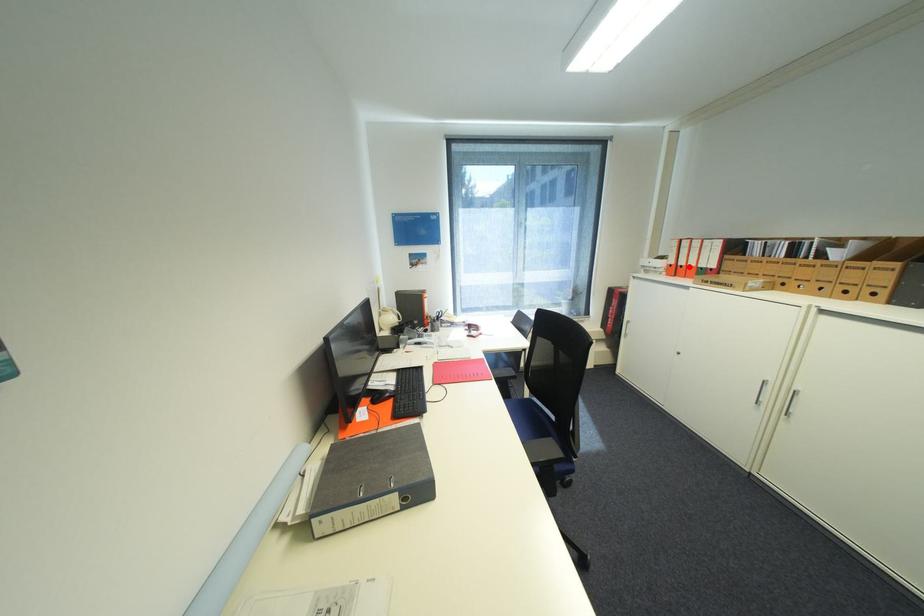
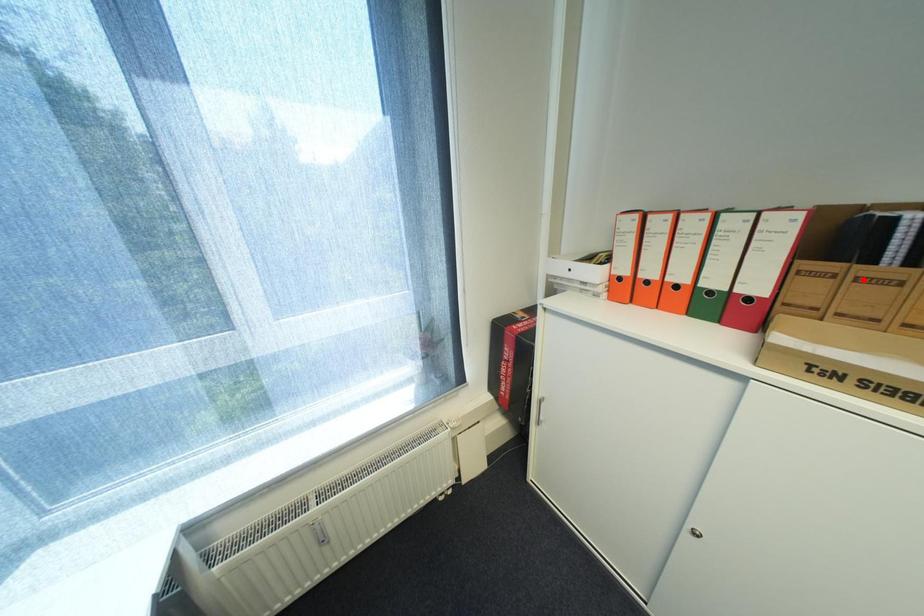
I am providing you with two images of the same scene from different viewpoints. A red point is marked on the first image and another point is marked on the second image. Are the points marked in image1 and image2 representing the same 3D position?

No